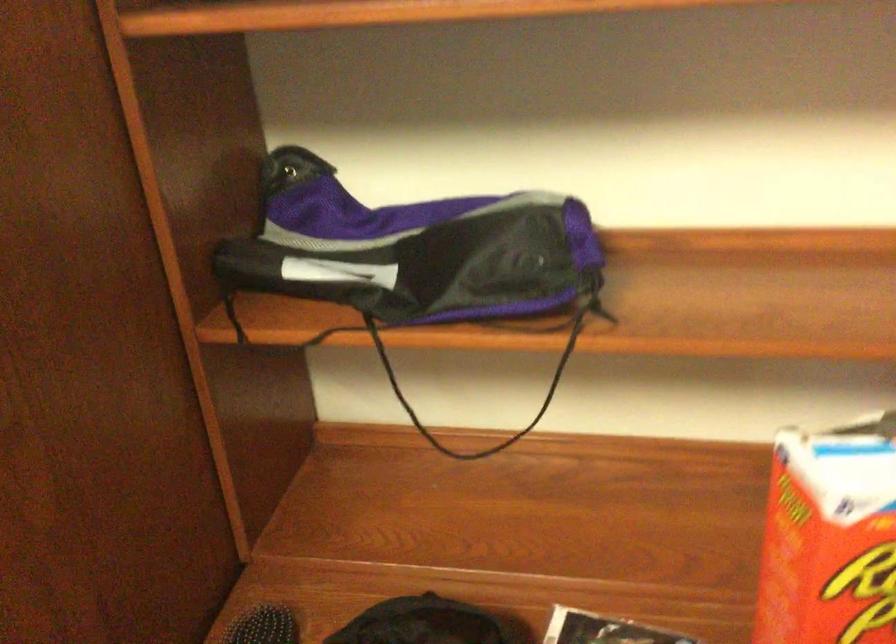
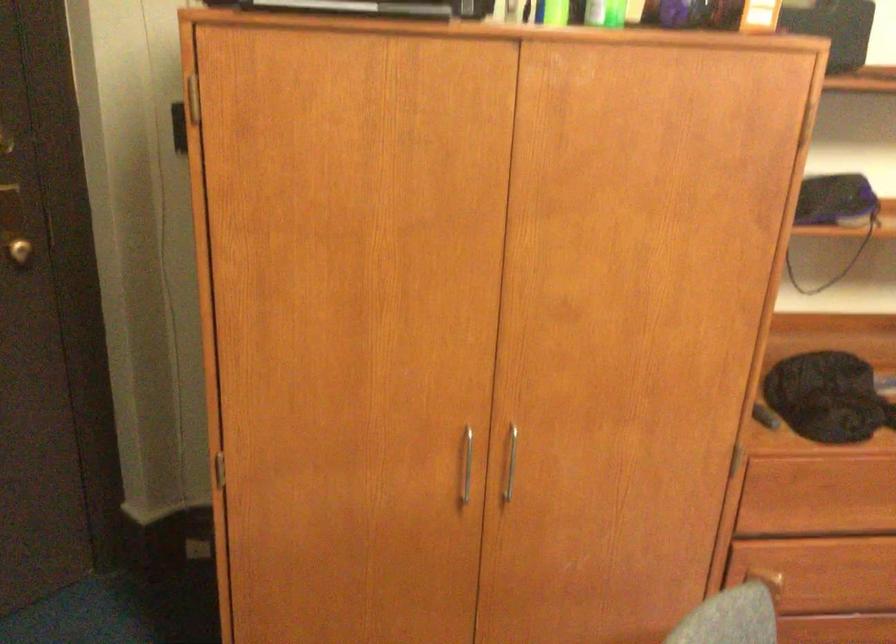
Question: I am providing you with two images of the same scene from different viewpoints. Which of the following objects are not visible in image2?

Choices:
 (A) round door knob
 (B) drawer handle
 (C) white spotted vase
 (D) purple and black bag

Answer: (D)